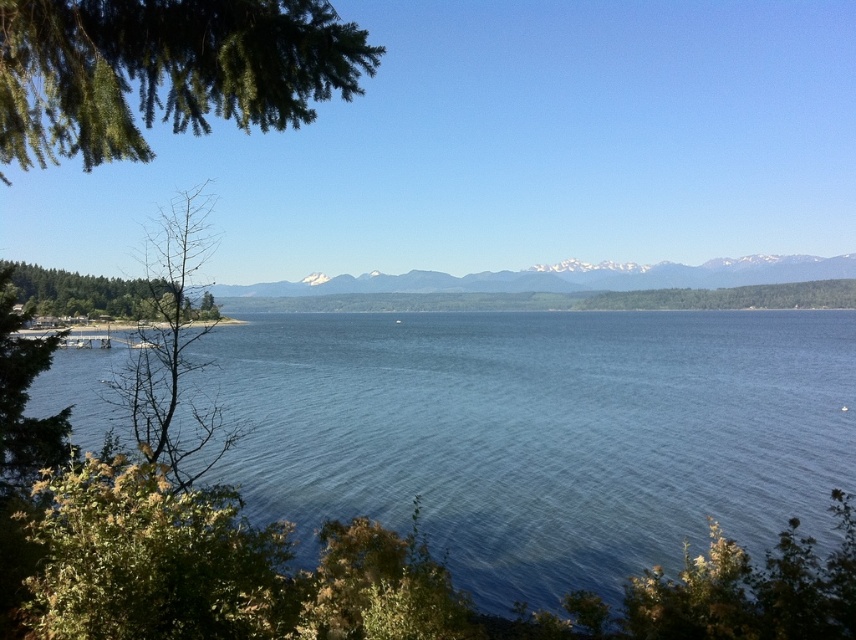
Is blue water at center wider than green leafy tree at lower left?

Indeed, blue water at center has a greater width compared to green leafy tree at lower left.

Where is `blue water at center`? blue water at center is located at coordinates (544, 433).

Locate an element on the screen. blue water at center is located at coordinates (544, 433).

This screenshot has width=856, height=640. Find the location of `bare branches at left`. bare branches at left is located at coordinates pyautogui.click(x=173, y=353).

Who is more forward, (x=203, y=396) or (x=19, y=394)?

Positioned in front is point (x=19, y=394).

Measure the distance between bare branches at left and camera.

They are 15.45 feet apart.

You are a GUI agent. You are given a task and a screenshot of the screen. Output one action in this format:
    pyautogui.click(x=<x>, y=<y>)
    Task: Click on the bare branches at left
    This screenshot has width=856, height=640.
    Given the screenshot: What is the action you would take?
    pyautogui.click(x=173, y=353)

From the picture: Who is positioned more to the right, green leafy tree at lower left or green matte tree at left?

From the viewer's perspective, green leafy tree at lower left appears more on the right side.

Describe the element at coordinates (24, 396) in the screenshot. I see `green leafy tree at lower left` at that location.

Does point (27, 317) lie behind point (120, 280)?

No, (27, 317) is closer to viewer.

The height and width of the screenshot is (640, 856). I want to click on green leafy tree at lower left, so click(x=24, y=396).